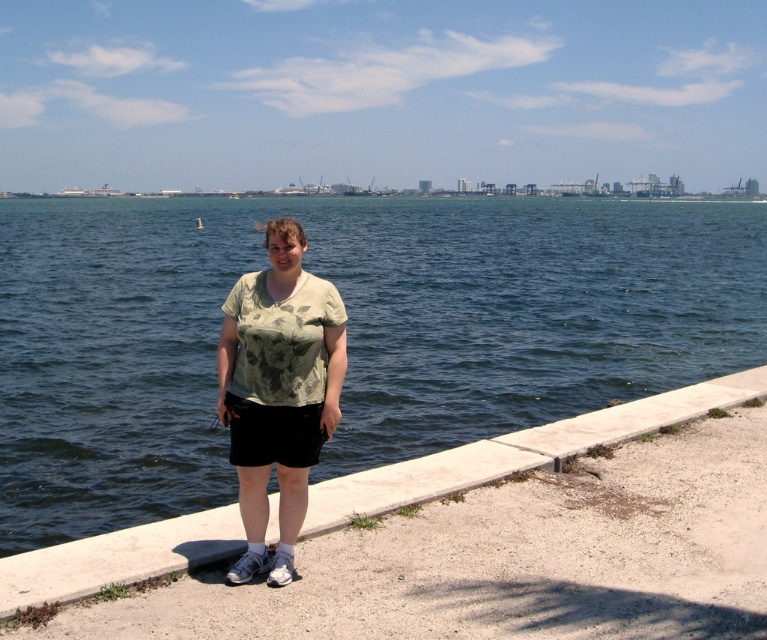
You are a photographer trying to capture a shot of the dark blue water at center and the green floral shirt at center. From the photographer perspective, which object is positioned to the left?

The dark blue water at center is to the left of the green floral shirt at center, so the dark blue water at center is positioned to the left.

You are a drone operator who needs to capture a closeup shot of the dark blue water at center. The drone can only descend to a minimum altitude of 4 meters. Can the drone safely descend to take the photo?

The distance between the dark blue water at center and the camera is 4.65 meters. Since the drone can descend to a minimum of 4 meters, it can safely descend to 4 meters and still be close enough to capture the dark blue water at center.